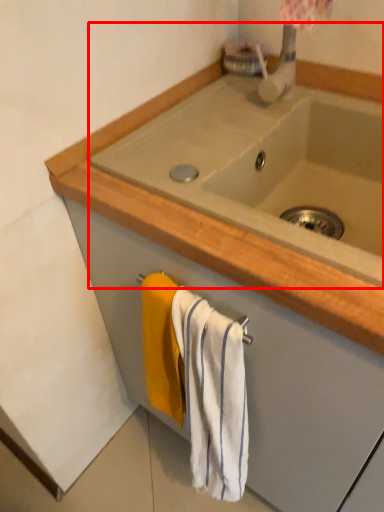
Question: In this image, where is sink (annotated by the red box) located relative to bath towel?

Choices:
 (A) right
 (B) left

Answer: (A)